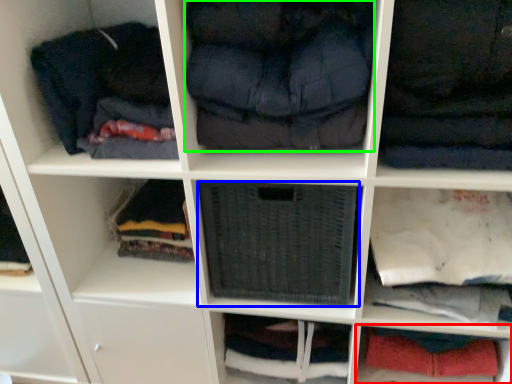
Question: Considering the real-world distances, which object is farthest from cabinet (highlighted by a red box)? cabinet (highlighted by a blue box) or clothing (highlighted by a green box)?

Choices:
 (A) cabinet
 (B) clothing

Answer: (B)